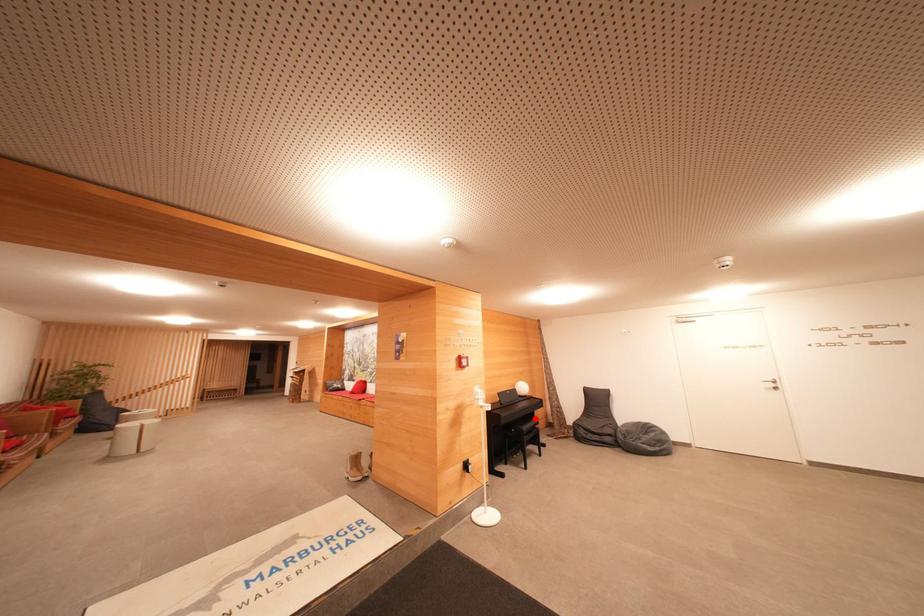
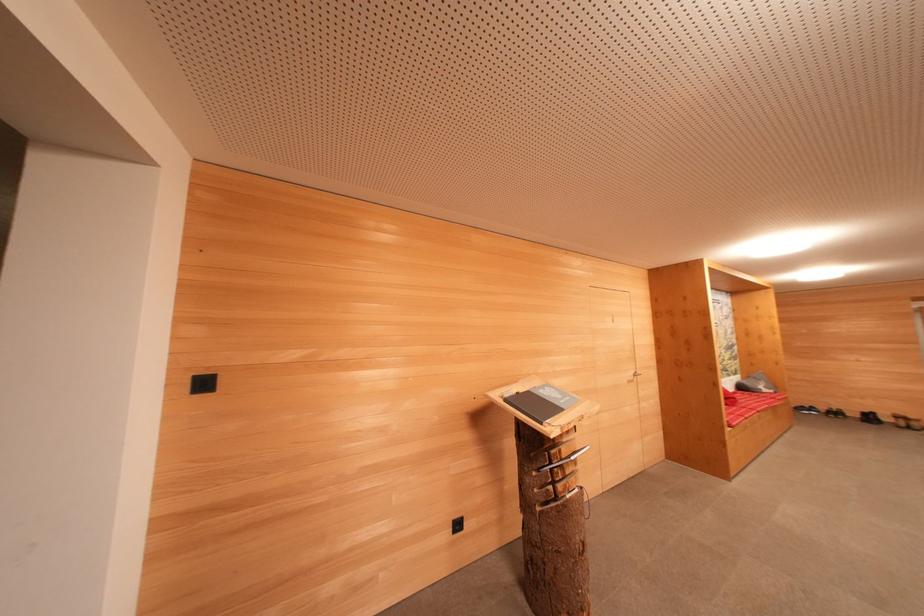
Question: I am providing you with two images of the same scene from different viewpoints. A red point is marked on the first image. Can you still see the location of the red point in image 2?

Choices:
 (A) Yes
 (B) No

Answer: (B)